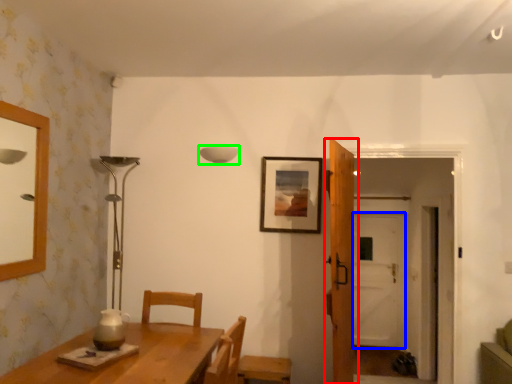
Question: Considering the real-world distances, which object is farthest from door (highlighted by a red box)? glass door (highlighted by a blue box) or lamp (highlighted by a green box)?

Choices:
 (A) glass door
 (B) lamp

Answer: (A)